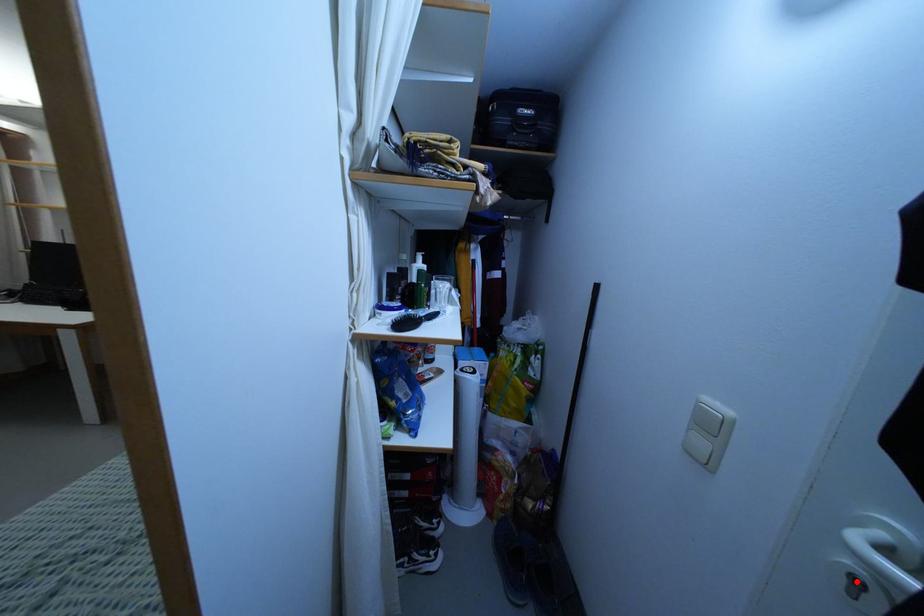
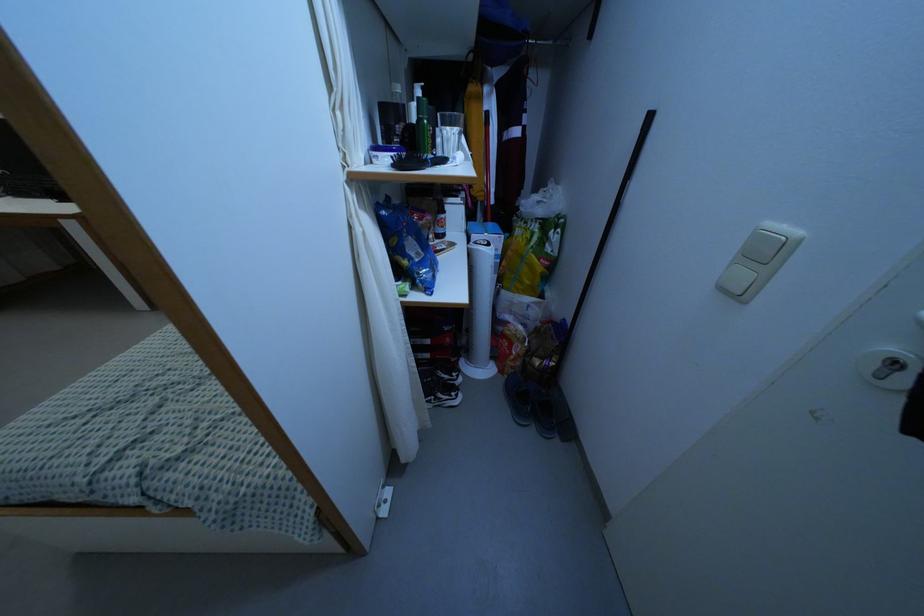
Question: I am providing you with two images of the same scene from different viewpoints. A red point is shown in image1. For the corresponding object point in image2, is it positioned nearer or farther from the camera?

Choices:
 (A) Nearer
 (B) Farther

Answer: (A)